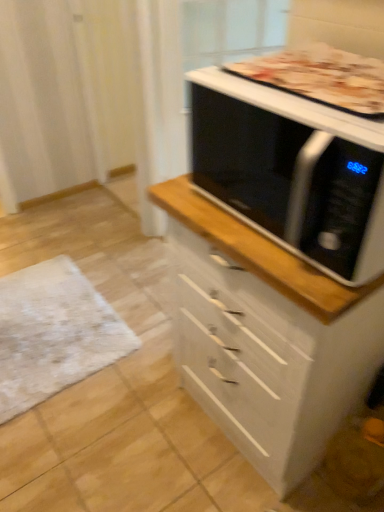
Question: Does golden brown crust at upper right have a smaller size compared to white glossy chest of drawers at center?

Choices:
 (A) no
 (B) yes

Answer: (B)

Question: Are golden brown crust at upper right and white glossy chest of drawers at center beside each other?

Choices:
 (A) yes
 (B) no

Answer: (B)

Question: From a real-world perspective, is golden brown crust at upper right beneath white glossy chest of drawers at center?

Choices:
 (A) no
 (B) yes

Answer: (A)

Question: Is golden brown crust at upper right bigger than white glossy chest of drawers at center?

Choices:
 (A) yes
 (B) no

Answer: (B)

Question: Is golden brown crust at upper right facing away from white glossy chest of drawers at center?

Choices:
 (A) yes
 (B) no

Answer: (B)

Question: From the image's perspective, relative to golden brown crust at upper right, is white textured mat at lower left above or below?

Choices:
 (A) below
 (B) above

Answer: (A)

Question: Does point (62, 290) appear closer or farther from the camera than point (322, 57)?

Choices:
 (A) farther
 (B) closer

Answer: (A)

Question: Based on their positions, is white textured mat at lower left located to the left or right of golden brown crust at upper right?

Choices:
 (A) right
 (B) left

Answer: (B)

Question: Considering the positions of white textured mat at lower left and golden brown crust at upper right in the image, is white textured mat at lower left wider or thinner than golden brown crust at upper right?

Choices:
 (A) thin
 (B) wide

Answer: (B)

Question: In terms of height, does golden brown crust at upper right look taller or shorter compared to black glossy microwave at upper right?

Choices:
 (A) tall
 (B) short

Answer: (B)

Question: From the image's perspective, relative to black glossy microwave at upper right, is golden brown crust at upper right above or below?

Choices:
 (A) above
 (B) below

Answer: (A)

Question: Is golden brown crust at upper right wider or thinner than black glossy microwave at upper right?

Choices:
 (A) wide
 (B) thin

Answer: (B)

Question: Relative to black glossy microwave at upper right, is golden brown crust at upper right in front or behind?

Choices:
 (A) behind
 (B) front

Answer: (A)

Question: From a real-world perspective, relative to golden brown crust at upper right, is black glossy microwave at upper right vertically above or below?

Choices:
 (A) below
 (B) above

Answer: (A)

Question: Looking at their shapes, would you say black glossy microwave at upper right is wider or thinner than golden brown crust at upper right?

Choices:
 (A) thin
 (B) wide

Answer: (B)